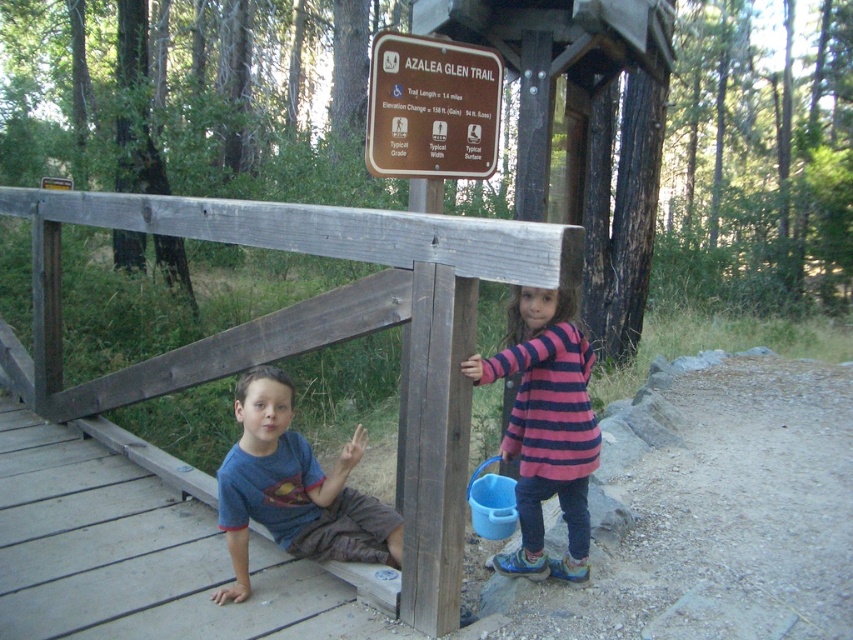
Can you confirm if pink striped sweater at center is smaller than brown wooden sign at upper center?

No, pink striped sweater at center is not smaller than brown wooden sign at upper center.

Is point (534, 531) behind point (498, 90)?

No, it is not.

Where is `pink striped sweater at center`? Image resolution: width=853 pixels, height=640 pixels. pink striped sweater at center is located at coordinates (546, 426).

Does blue cotton shirt at lower left have a smaller size compared to brown wooden sign at upper center?

Incorrect, blue cotton shirt at lower left is not smaller in size than brown wooden sign at upper center.

Is point (260, 465) in front of point (442, 44)?

Yes, point (260, 465) is closer to viewer.

Describe the element at coordinates (294, 490) in the screenshot. I see `blue cotton shirt at lower left` at that location.

Locate an element on the screen. The image size is (853, 640). blue cotton shirt at lower left is located at coordinates (294, 490).

Which is more to the right, pink striped sweater at center or blue cotton shirt at lower left?

pink striped sweater at center

Describe the element at coordinates (546, 426) in the screenshot. The width and height of the screenshot is (853, 640). I see `pink striped sweater at center` at that location.

Identify the location of pink striped sweater at center. The width and height of the screenshot is (853, 640). (546, 426).